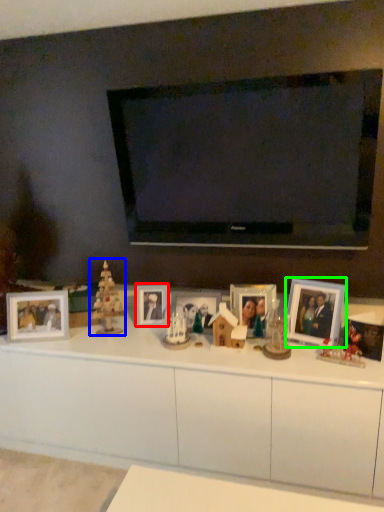
Question: Which object is the closest to the picture frame (highlighted by a red box)? Choose among these: christmas decoration (highlighted by a blue box) or picture frame (highlighted by a green box).

Choices:
 (A) christmas decoration
 (B) picture frame

Answer: (A)